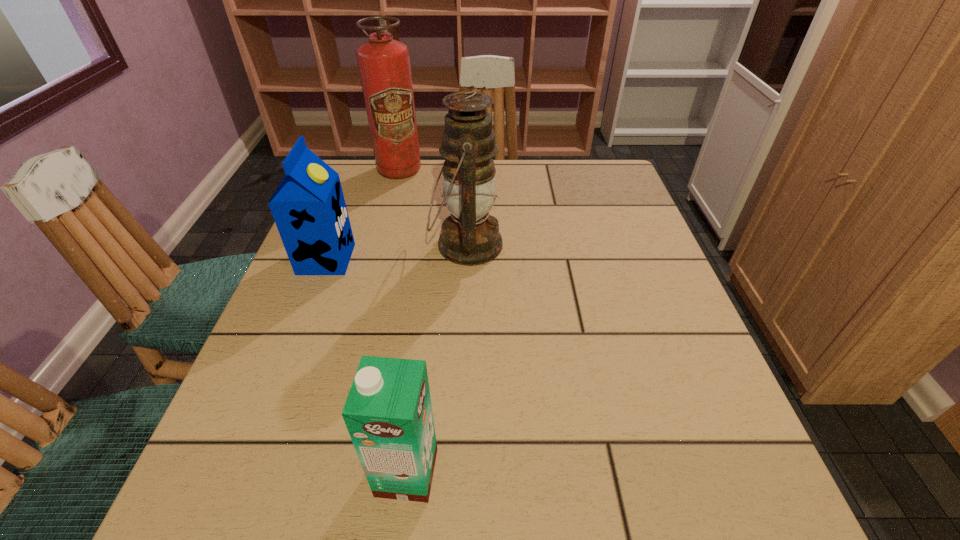
At what (x,y) coordinates should I click in order to perform the action: click on vacant space at the far right corner of the desktop. Please return your answer as a coordinate pair (x, y). The width and height of the screenshot is (960, 540). Looking at the image, I should click on (614, 163).

Where is `empty location between the lantern and the farther carton`? empty location between the lantern and the farther carton is located at coordinates (396, 252).

Identify the location of free spot between the farthest object and the lantern. The image size is (960, 540). (433, 207).

Find the location of a particular element. vacant area between the right carton and the lantern is located at coordinates (437, 359).

Identify the location of free space between the farthest object and the nearest object. (403, 321).

Image resolution: width=960 pixels, height=540 pixels. I want to click on vacant space in between the left carton and the fire extinguisher, so click(x=363, y=214).

At what (x,y) coordinates should I click in order to perform the action: click on free area in between the left carton and the lantern. Please return your answer as a coordinate pair (x, y). Image resolution: width=960 pixels, height=540 pixels. Looking at the image, I should click on (396, 252).

You are a GUI agent. You are given a task and a screenshot of the screen. Output one action in this format:
    pyautogui.click(x=<x>, y=<y>)
    Task: Click on the vacant area that lies between the lantern and the fire extinguisher
    Image resolution: width=960 pixels, height=540 pixels.
    Given the screenshot: What is the action you would take?
    pyautogui.click(x=433, y=207)

This screenshot has width=960, height=540. Find the location of `vacant space that's between the left carton and the lantern`. vacant space that's between the left carton and the lantern is located at coordinates (396, 252).

Locate an element on the screen. empty space between the farthest object and the left carton is located at coordinates (363, 214).